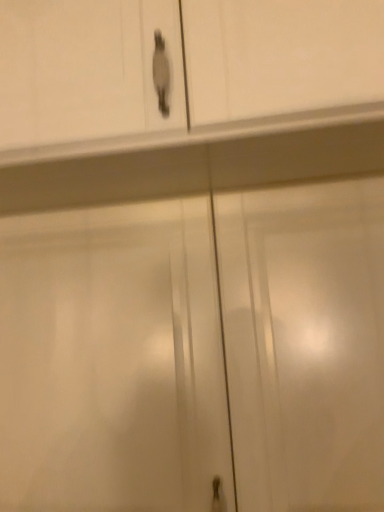
Question: Is matte white cabinet at upper center positioned with its back to white glossy cabinet doors at center?

Choices:
 (A) no
 (B) yes

Answer: (A)

Question: Is matte white cabinet at upper center at the left side of white glossy cabinet doors at center?

Choices:
 (A) no
 (B) yes

Answer: (B)

Question: Can you confirm if matte white cabinet at upper center is wider than white glossy cabinet doors at center?

Choices:
 (A) no
 (B) yes

Answer: (B)

Question: Are matte white cabinet at upper center and white glossy cabinet doors at center far apart?

Choices:
 (A) yes
 (B) no

Answer: (B)

Question: Is matte white cabinet at upper center at the right side of white glossy cabinet doors at center?

Choices:
 (A) no
 (B) yes

Answer: (A)

Question: Is matte white cabinet at upper center in contact with white glossy cabinet doors at center?

Choices:
 (A) yes
 (B) no

Answer: (B)

Question: Is white glossy cabinet doors at center touching matte white cabinet at upper center?

Choices:
 (A) no
 (B) yes

Answer: (A)

Question: Considering the relative sizes of white glossy cabinet doors at center and matte white cabinet at upper center in the image provided, is white glossy cabinet doors at center bigger than matte white cabinet at upper center?

Choices:
 (A) yes
 (B) no

Answer: (B)

Question: From a real-world perspective, is white glossy cabinet doors at center over matte white cabinet at upper center?

Choices:
 (A) no
 (B) yes

Answer: (A)

Question: Does white glossy cabinet doors at center turn towards matte white cabinet at upper center?

Choices:
 (A) yes
 (B) no

Answer: (B)

Question: Is white glossy cabinet doors at center taller than matte white cabinet at upper center?

Choices:
 (A) yes
 (B) no

Answer: (A)

Question: Does white glossy cabinet doors at center come behind matte white cabinet at upper center?

Choices:
 (A) yes
 (B) no

Answer: (A)

Question: Considering the positions of white glossy cabinet doors at center and matte white cabinet at upper center in the image, is white glossy cabinet doors at center taller or shorter than matte white cabinet at upper center?

Choices:
 (A) short
 (B) tall

Answer: (B)